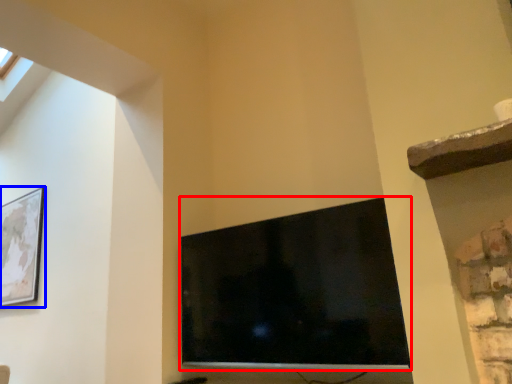
Question: Which point is further to the camera, television (highlighted by a red box) or picture frame (highlighted by a blue box)?

Choices:
 (A) television
 (B) picture frame

Answer: (B)